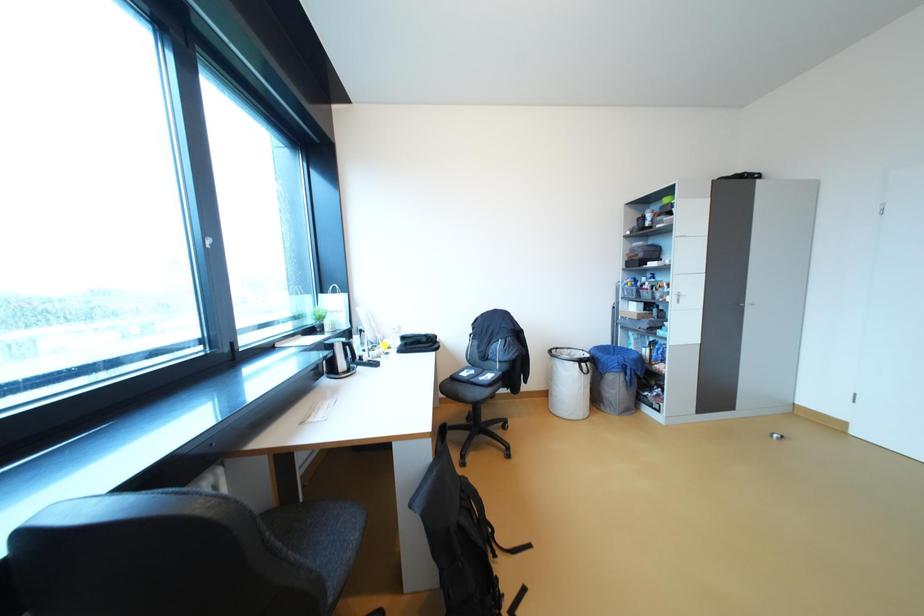
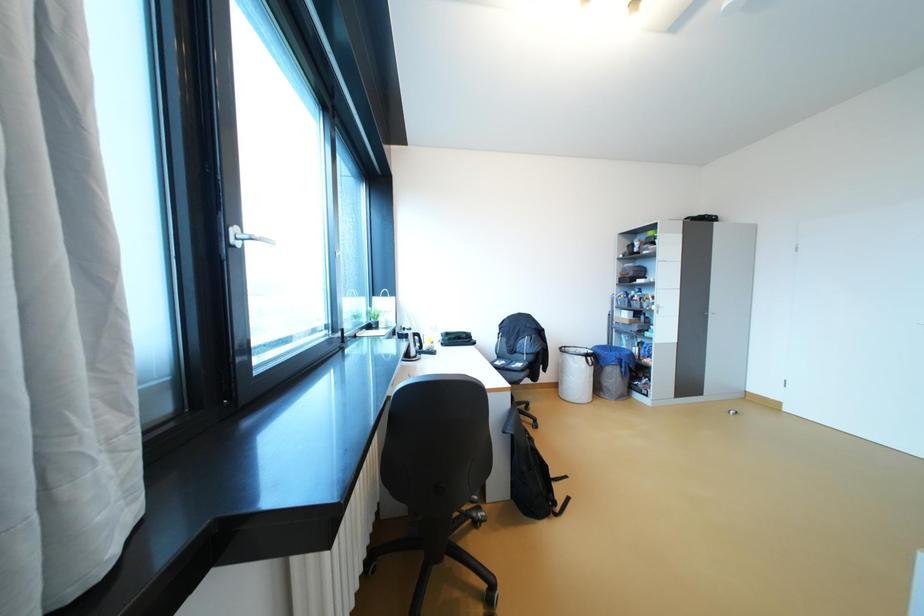
Question: The images are taken continuously from a first-person perspective. In which direction is your viewpoint rotating?

Choices:
 (A) Left
 (B) Right
 (C) Up
 (D) Down

Answer: (B)